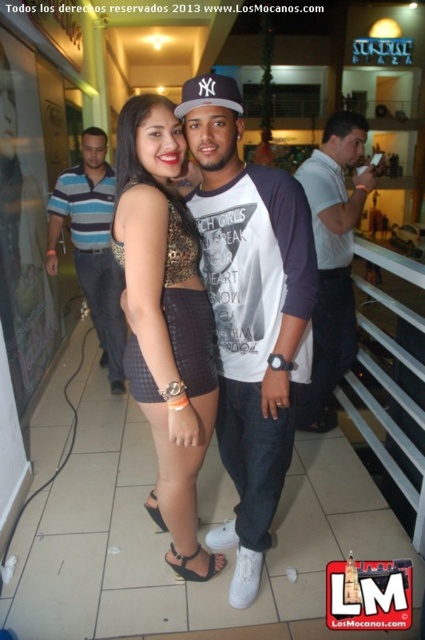
Is white cotton shirt at center bigger than white fabric baseball cap at center?

Indeed, white cotton shirt at center has a larger size compared to white fabric baseball cap at center.

Between point (339, 184) and point (215, 74), which one is positioned behind?

Point (215, 74)

At what (x,y) coordinates should I click in order to perform the action: click on white cotton shirt at center. Please return your answer as a coordinate pair (x, y). Image resolution: width=425 pixels, height=640 pixels. Looking at the image, I should click on (333, 259).

Can you confirm if leopard print dress at center is thinner than white fabric baseball cap at center?

In fact, leopard print dress at center might be wider than white fabric baseball cap at center.

Is leopard print dress at center smaller than white fabric baseball cap at center?

Actually, leopard print dress at center might be larger than white fabric baseball cap at center.

You are a GUI agent. You are given a task and a screenshot of the screen. Output one action in this format:
    pyautogui.click(x=<x>, y=<y>)
    Task: Click on the leopard print dress at center
    
    Given the screenshot: What is the action you would take?
    pyautogui.click(x=166, y=321)

Is white cotton shirt at center closer to the viewer compared to striped polo shirt at left?

Yes.

Between point (353, 353) and point (88, 296), which one is positioned in front?

Point (353, 353)

Which is in front, point (351, 200) or point (59, 225)?

Point (351, 200) is more forward.

Locate an element on the screen. This screenshot has width=425, height=640. white cotton shirt at center is located at coordinates (333, 259).